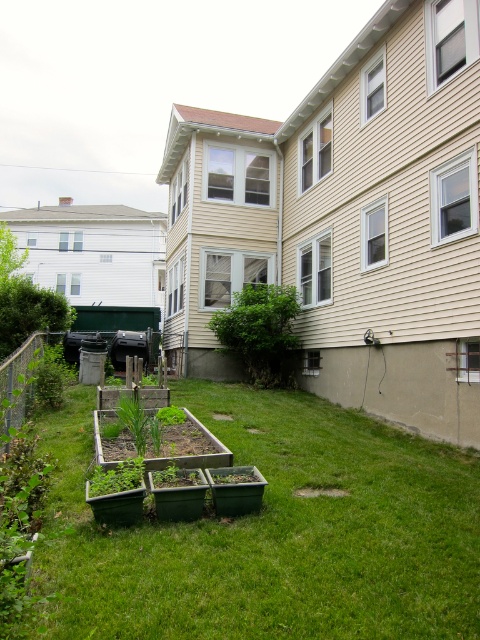
You are standing in the backyard and want to plant vegetables. The point where you should go to plant them is marked as point (202, 476). What object is located at this point?

The green wooden raised beds at center is located at point (202, 476).

You are standing at the edge of the green grass at lower center and want to reach the green wooden raised beds at center. Which direction should you move to get there?

You should move upwards from the green grass at lower center to reach the green wooden raised beds at center since the green grass at lower center is below the green wooden raised beds at center.